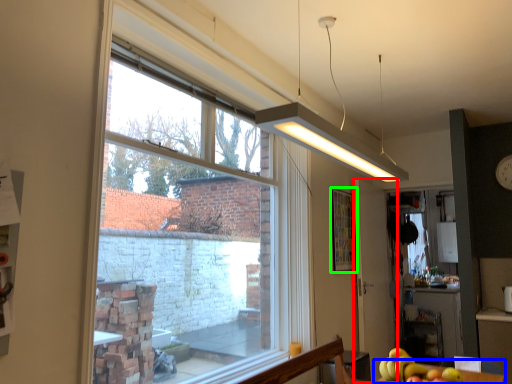
Question: Which object is the closest to the screen door (highlighted by a red box)? Choose among these: table (highlighted by a blue box) or bulletin board (highlighted by a green box).

Choices:
 (A) table
 (B) bulletin board

Answer: (B)